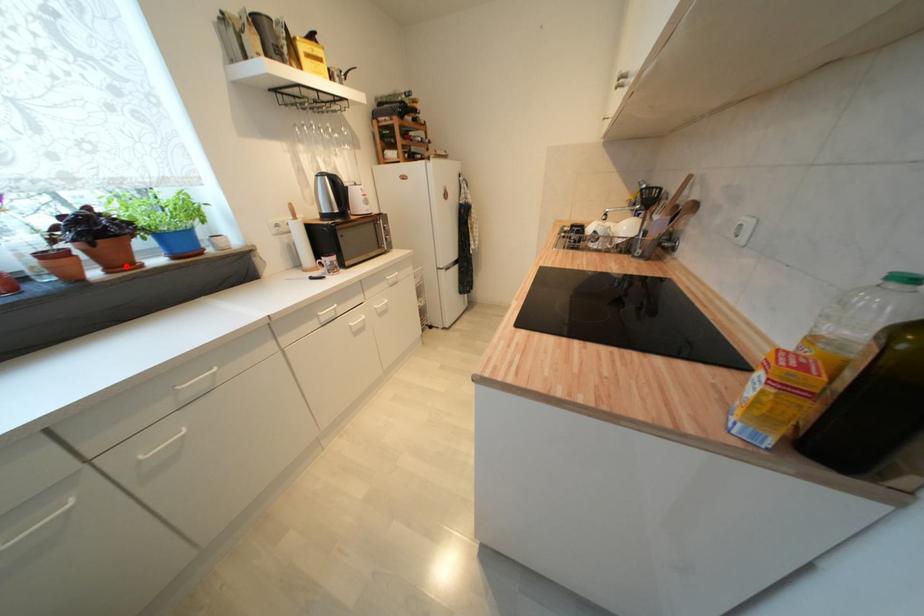
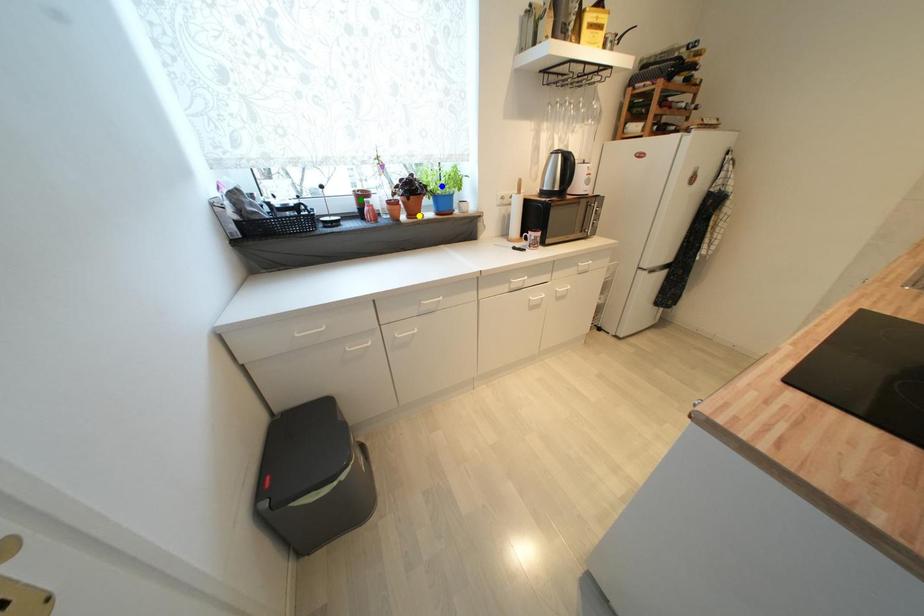
Question: I am providing you with two images of the same scene from different viewpoints. A red point is marked on the first image. You are given multiple points on the second image. Which mark in image 2 goes with the point in image 1?

Choices:
 (A) blue point
 (B) yellow point
 (C) green point

Answer: (B)